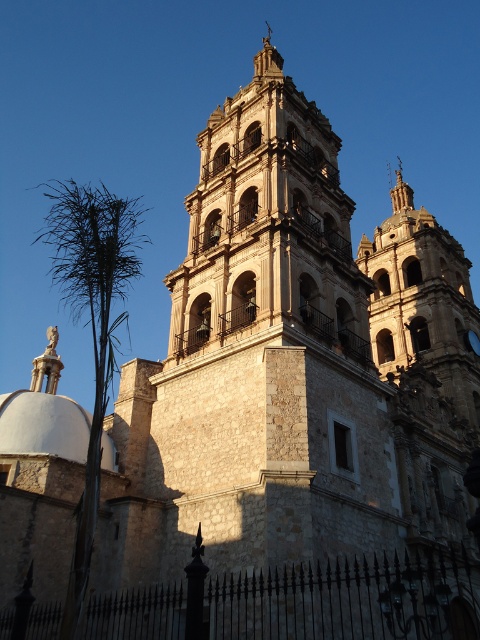
You are an architect assessing the church layout. You need to determine which object, the stone bell tower at upper right or the green leafy palm tree at left, is taller. Based on the scene, which one is taller?

The green leafy palm tree at left is taller than the stone bell tower at upper right.